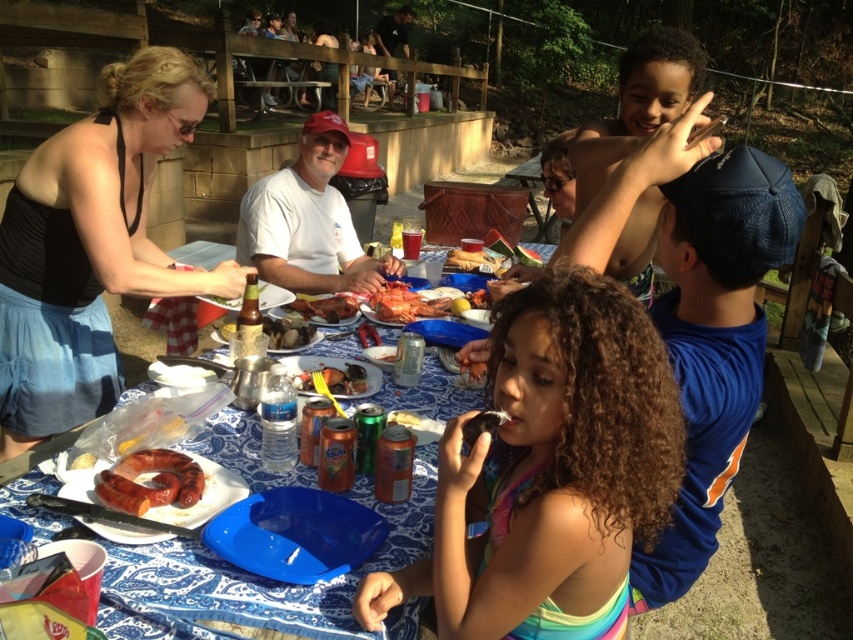
You are at a picnic and want to place your shiny plastic fork at center on top of the white paper plate at center. Will the fork fit entirely on the plate?

The white paper plate at center is smaller than the shiny plastic fork at center, so the fork will not fit entirely on the plate.

You are standing at the picnic table and want to reach both the point at coordinates (196, 68) and the point at (289, 323). Which point is closer to you?

The point at coordinates (196, 68) is closer to you because it is in front of the point at (289, 323).